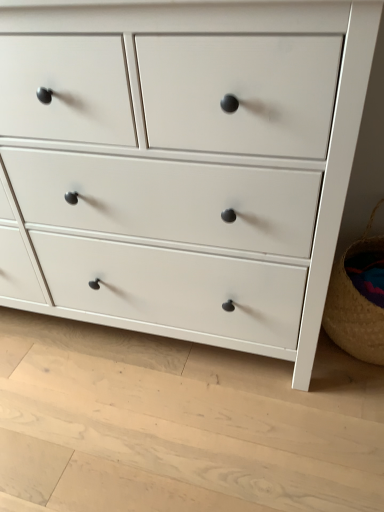
What do you see at coordinates (358, 298) in the screenshot? The width and height of the screenshot is (384, 512). I see `woven straw basket at lower right` at bounding box center [358, 298].

Locate an element on the screen. woven straw basket at lower right is located at coordinates (358, 298).

This screenshot has width=384, height=512. Identify the location of woven straw basket at lower right. (358, 298).